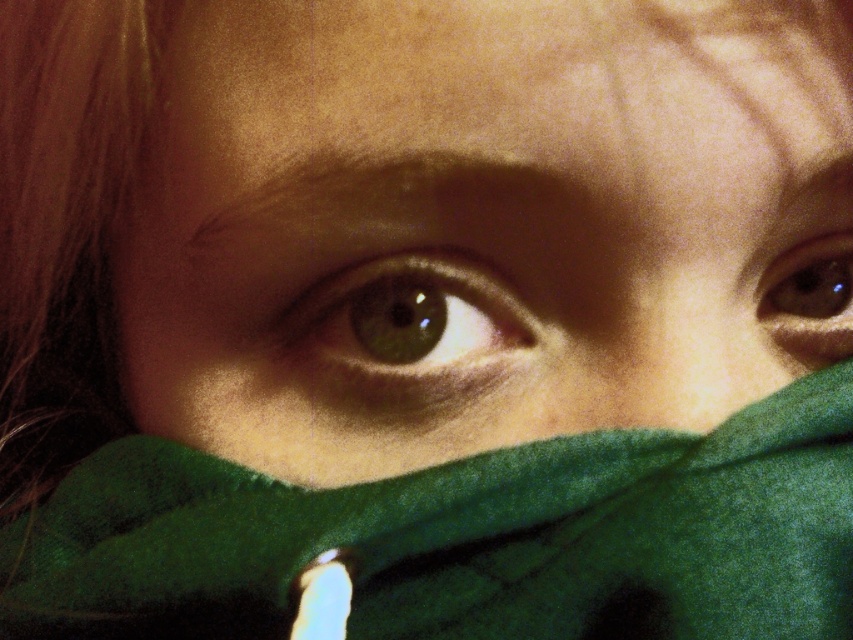
Question: Can you confirm if smooth skin nose at center is positioned to the right of brown matte eye at upper right?

Choices:
 (A) no
 (B) yes

Answer: (A)

Question: Which of the following is the farthest from the observer?

Choices:
 (A) [515, 618]
 (B) [665, 298]

Answer: (B)

Question: Can you confirm if green fabric at center is positioned to the right of green fleece scarf at center?

Choices:
 (A) no
 (B) yes

Answer: (B)

Question: Among these points, which one is nearest to the camera?

Choices:
 (A) (703, 349)
 (B) (838, 323)
 (C) (589, 346)

Answer: (A)

Question: Which object is closer to the camera taking this photo?

Choices:
 (A) brown matte eye at upper right
 (B) green fabric at center
 (C) smooth skin nose at center
 (D) green matte eye at center

Answer: (B)

Question: Can you confirm if green fleece scarf at center is wider than smooth skin nose at center?

Choices:
 (A) no
 (B) yes

Answer: (B)